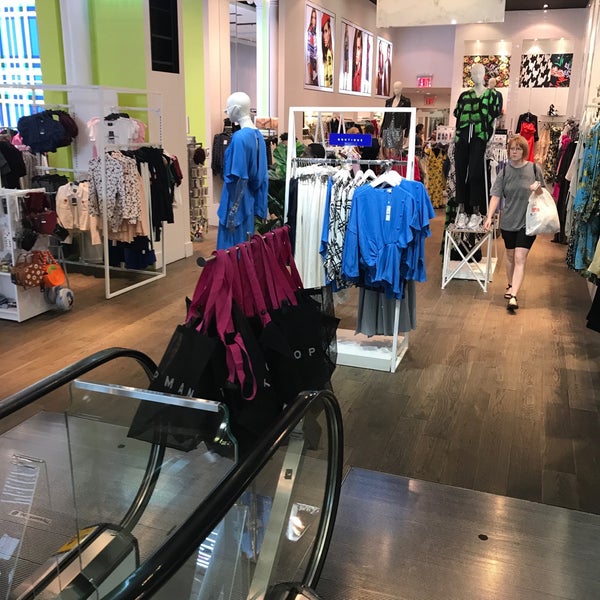
You are a GUI agent. You are given a task and a screenshot of the screen. Output one action in this format:
    pyautogui.click(x=<x>, y=<y>)
    Task: Click on the metal floor
    Image resolution: width=600 pixels, height=600 pixels.
    Given the screenshot: What is the action you would take?
    pyautogui.click(x=445, y=545)